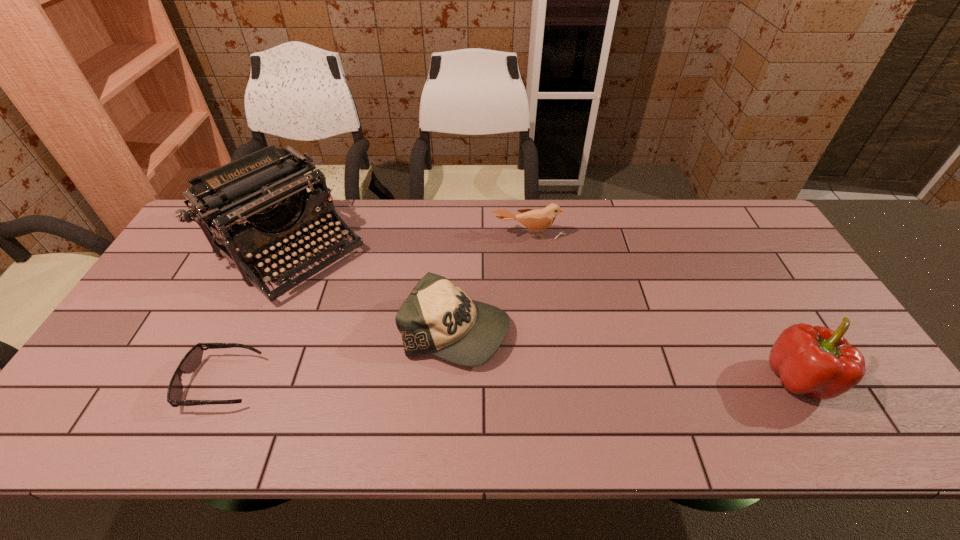
You are a GUI agent. You are given a task and a screenshot of the screen. Output one action in this format:
    pyautogui.click(x=<x>, y=<y>)
    Task: Click on the pepper located at the near edge
    
    Given the screenshot: What is the action you would take?
    pyautogui.click(x=817, y=361)

Locate an element on the screen. This screenshot has width=960, height=540. baseball cap situated at the near edge is located at coordinates (439, 318).

The width and height of the screenshot is (960, 540). I want to click on object present at the left edge, so click(262, 198).

Where is `object positioned at the right edge`? Image resolution: width=960 pixels, height=540 pixels. object positioned at the right edge is located at coordinates (817, 361).

Locate an element on the screen. object positioned at the far left corner is located at coordinates (262, 198).

Locate an element on the screen. The image size is (960, 540). object that is at the near right corner is located at coordinates (817, 361).

You are a GUI agent. You are given a task and a screenshot of the screen. Output one action in this format:
    pyautogui.click(x=<x>, y=<y>)
    Task: Click on the vacant space at the far edge of the desktop
    The width and height of the screenshot is (960, 540).
    Given the screenshot: What is the action you would take?
    pyautogui.click(x=481, y=217)

Where is `free space at the near edge of the desktop`? free space at the near edge of the desktop is located at coordinates (642, 388).

Identify the location of free space at the left edge of the desktop. Image resolution: width=960 pixels, height=540 pixels. (155, 330).

Image resolution: width=960 pixels, height=540 pixels. I want to click on vacant space at the far right corner of the desktop, so click(x=718, y=199).